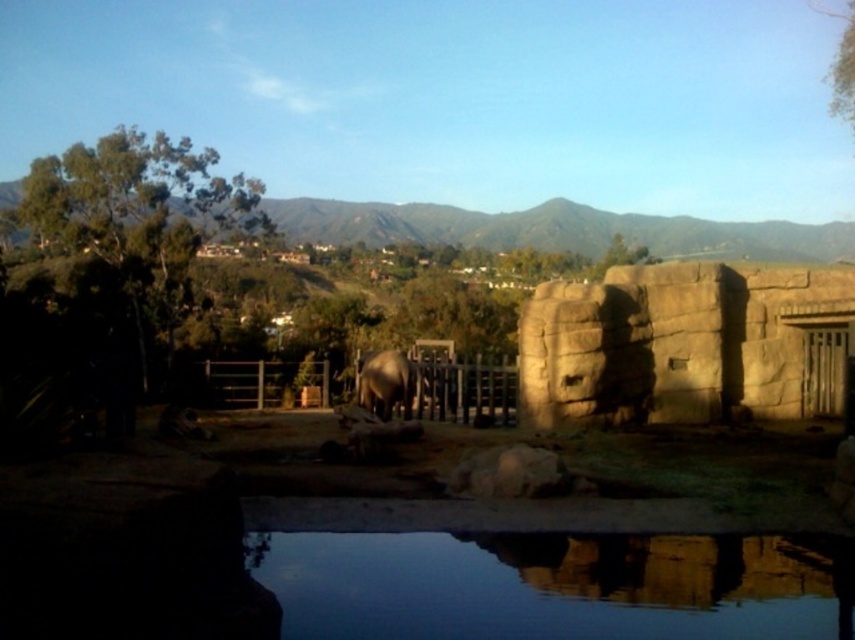
Question: Which point is closer to the camera?

Choices:
 (A) tap(298, 620)
 (B) tap(749, 412)

Answer: (A)

Question: Can you confirm if brown stone wall at center right is positioned below brown wooden fence at center?

Choices:
 (A) no
 (B) yes

Answer: (A)

Question: Observing the image, what is the correct spatial positioning of brown wooden fence at center in reference to gray matte elephant at center?

Choices:
 (A) right
 (B) left

Answer: (B)

Question: Which object is positioned closest to the brown wooden fence at center?

Choices:
 (A) brown stone wall at center right
 (B) smooth reflective water at lower center

Answer: (A)

Question: Among these points, which one is farthest from the camera?

Choices:
 (A) 252,392
 (B) 624,400
 (C) 525,598

Answer: (A)

Question: Can you confirm if brown stone wall at center right is thinner than brown wooden fence at center?

Choices:
 (A) yes
 (B) no

Answer: (A)